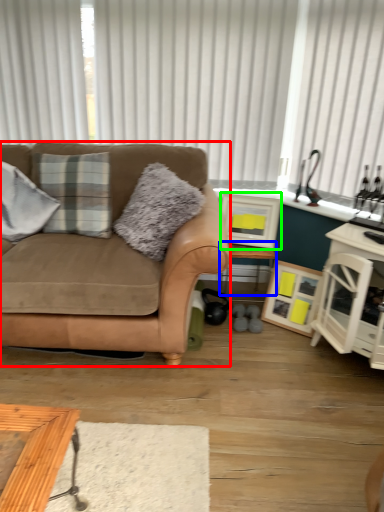
Question: Which object is positioned closest to studio couch (highlighted by a red box)? Select from table (highlighted by a blue box) and picture frame (highlighted by a green box).

Choices:
 (A) table
 (B) picture frame

Answer: (B)